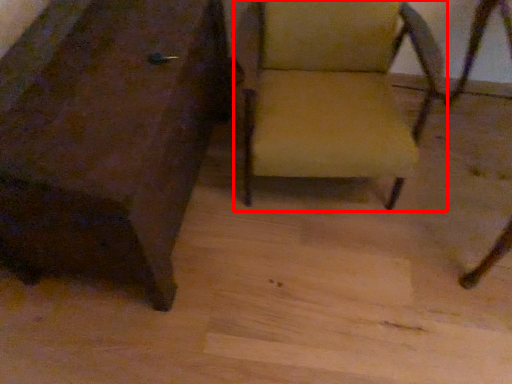
Question: Considering the relative positions of chair (annotated by the red box) and chair in the image provided, where is chair (annotated by the red box) located with respect to the staircase?

Choices:
 (A) right
 (B) left

Answer: (A)